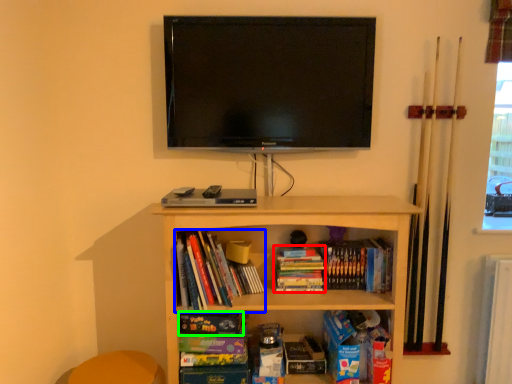
Question: Which object is the farthest from book (highlighted by a red box)? Choose among these: book (highlighted by a blue box) or paperback book (highlighted by a green box).

Choices:
 (A) book
 (B) paperback book

Answer: (B)